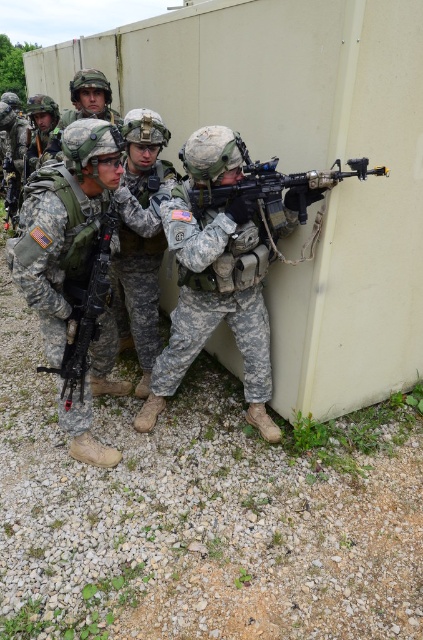
Question: Can you confirm if camouflage uniform at center is thinner than matte black rifle at center?

Choices:
 (A) yes
 (B) no

Answer: (A)

Question: Which of the following is the farthest from the observer?

Choices:
 (A) (189, 195)
 (B) (82, 186)

Answer: (A)

Question: Among these objects, which one is farthest from the camera?

Choices:
 (A) camouflage uniform at center
 (B) matte black rifle at center

Answer: (A)

Question: Can you confirm if matte black rifle at center is thinner than matte black machine gun at center?

Choices:
 (A) no
 (B) yes

Answer: (A)

Question: Considering the real-world distances, which object is farthest from the matte black rifle at center?

Choices:
 (A) camouflage uniform at left
 (B) camouflage uniform at center

Answer: (B)

Question: Is camouflage uniform at center to the right of matte black rifle at center from the viewer's perspective?

Choices:
 (A) yes
 (B) no

Answer: (B)